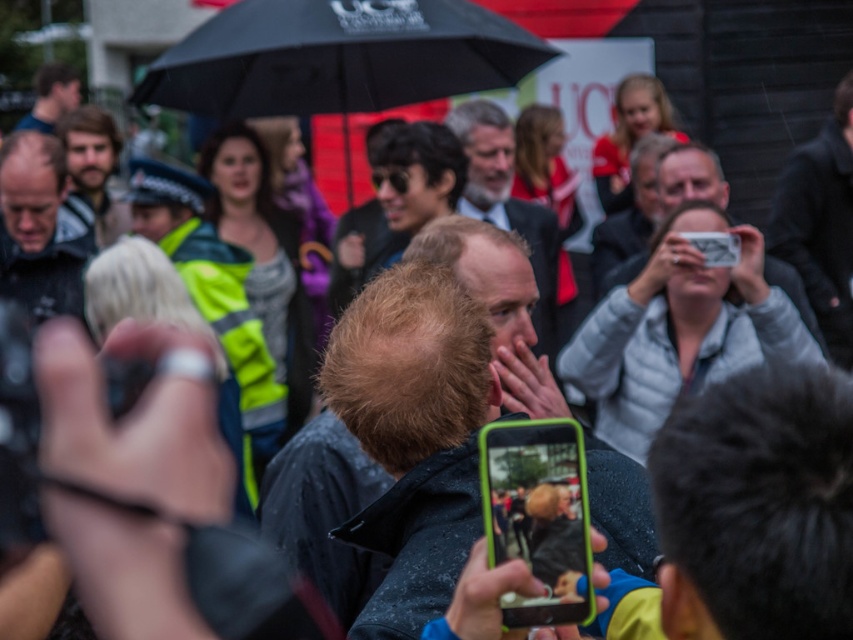
Question: Which point appears closest to the camera in this image?

Choices:
 (A) (415, 141)
 (B) (33, 125)
 (C) (793, 300)

Answer: (C)

Question: Among these points, which one is farthest from the camera?

Choices:
 (A) (474, 76)
 (B) (477, 193)
 (C) (51, 218)

Answer: (B)

Question: Among these points, which one is nearest to the camera?

Choices:
 (A) click(416, 497)
 (B) click(44, 100)

Answer: (A)

Question: Does black matte umbrella at center have a lesser width compared to gray fabric jacket at upper center?

Choices:
 (A) yes
 (B) no

Answer: (B)

Question: Where is smooth bald head at left located in relation to gray fabric jacket at upper center in the image?

Choices:
 (A) right
 (B) left

Answer: (B)

Question: Is black matte umbrella at center wider than smooth gray suit at center?

Choices:
 (A) no
 (B) yes

Answer: (B)